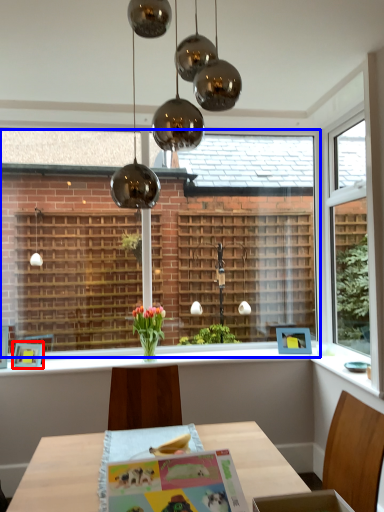
Question: Which object is closer to the camera taking this photo, picture frame (highlighted by a red box) or bay window (highlighted by a blue box)?

Choices:
 (A) picture frame
 (B) bay window

Answer: (A)